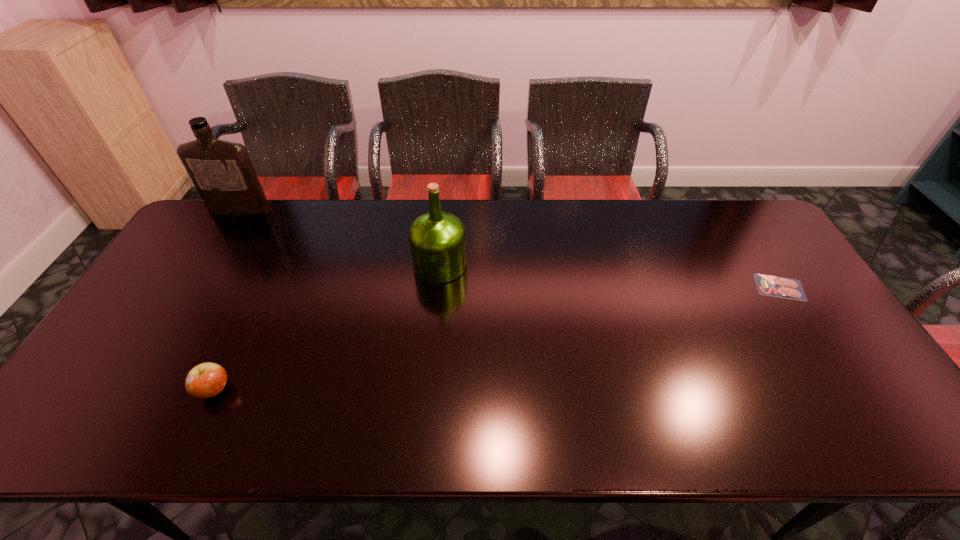
Image resolution: width=960 pixels, height=540 pixels. I want to click on free space located on the back of the second shortest object, so (x=249, y=318).

The width and height of the screenshot is (960, 540). What are the coordinates of `vacant region located 0.090m on the front of the shortest object` in the screenshot? It's located at (805, 326).

You are a GUI agent. You are given a task and a screenshot of the screen. Output one action in this format:
    pyautogui.click(x=<x>, y=<y>)
    Task: Click on the object that is at the far edge
    This screenshot has width=960, height=540.
    Given the screenshot: What is the action you would take?
    pyautogui.click(x=222, y=172)

In order to click on object that is at the left edge in this screenshot , I will do `click(222, 172)`.

What are the coordinates of `object that is at the right edge` in the screenshot? It's located at 782,287.

This screenshot has width=960, height=540. Find the location of `object present at the far left corner`. object present at the far left corner is located at coordinates (222, 172).

The image size is (960, 540). Identify the location of free region at the far edge of the desktop. (545, 203).

Find the location of a particular element. This screenshot has height=540, width=960. free space at the left edge is located at coordinates (170, 268).

Find the location of `free space at the near left corner of the desktop`. free space at the near left corner of the desktop is located at coordinates click(111, 428).

Find the location of a particular element. Image resolution: width=960 pixels, height=540 pixels. empty space that is in between the nearest object and the second tallest object is located at coordinates (327, 327).